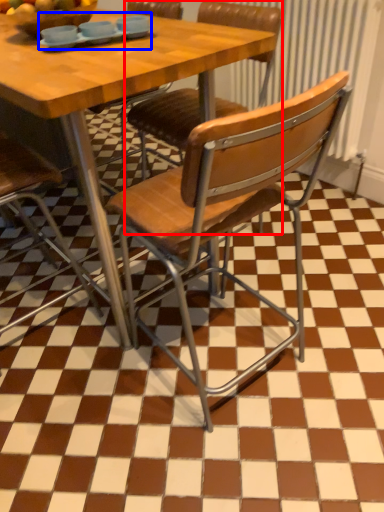
Question: Among these objects, which one is farthest to the camera, chair (highlighted by a red box) or tableware (highlighted by a blue box)?

Choices:
 (A) chair
 (B) tableware

Answer: (A)